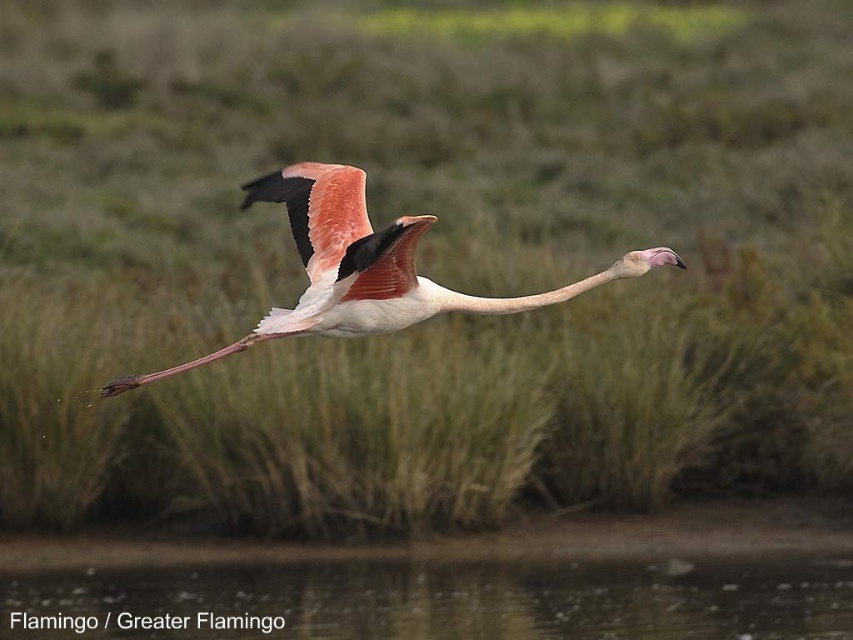
This screenshot has width=853, height=640. I want to click on transparent water at lower center, so [x=438, y=602].

Does point (790, 576) lie behind point (523, 304)?

Yes, it is behind point (523, 304).

Which is behind, point (408, 563) or point (434, 310)?

Point (408, 563)

You are a GUI agent. You are given a task and a screenshot of the screen. Output one action in this format:
    pyautogui.click(x=<x>, y=<y>)
    Task: Click on the transparent water at lower center
    
    Given the screenshot: What is the action you would take?
    pyautogui.click(x=438, y=602)